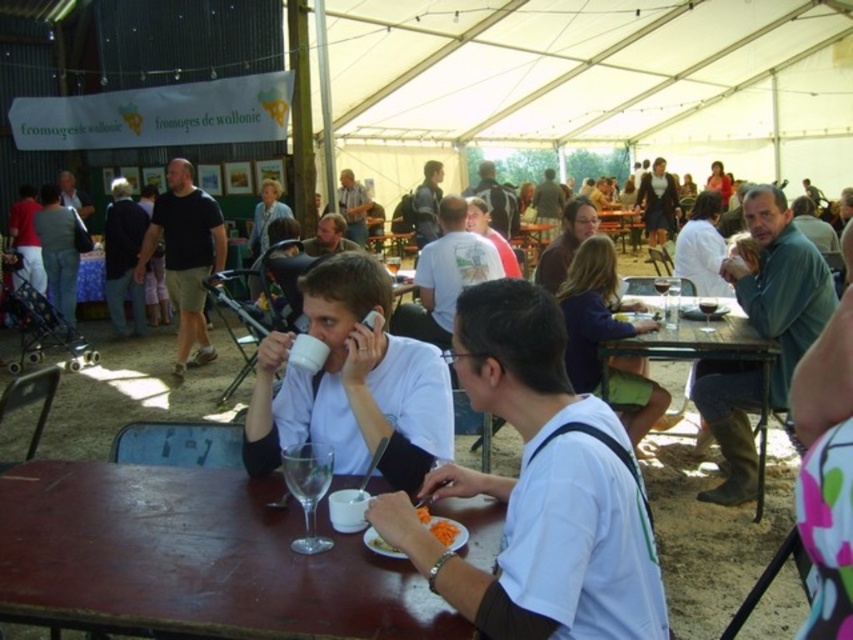
Question: Which point is farther from the camera taking this photo?

Choices:
 (A) (424, 189)
 (B) (708, 333)
 (C) (759, 330)

Answer: (A)

Question: Considering the relative positions of matte white shirt at center and carrot shredded salad at lower center in the image provided, where is matte white shirt at center located with respect to carrot shredded salad at lower center?

Choices:
 (A) left
 (B) right

Answer: (B)

Question: Is wooden table at lower center thinner than matte white shirt at center?

Choices:
 (A) no
 (B) yes

Answer: (A)

Question: Is wooden table at lower right wider than matte gray shirt at center?

Choices:
 (A) no
 (B) yes

Answer: (B)

Question: Estimate the real-world distances between objects in this image. Which object is farther from the green cotton shirt at right?

Choices:
 (A) clear glass wine at table center
 (B) light brown leather jacket at center
 (C) black cotton shirt at center
 (D) wooden table at lower center

Answer: (B)

Question: Estimate the real-world distances between objects in this image. Which object is closer to the matte white shirt at center?

Choices:
 (A) clear glass wine at table center
 (B) matte gray shirt at center

Answer: (B)